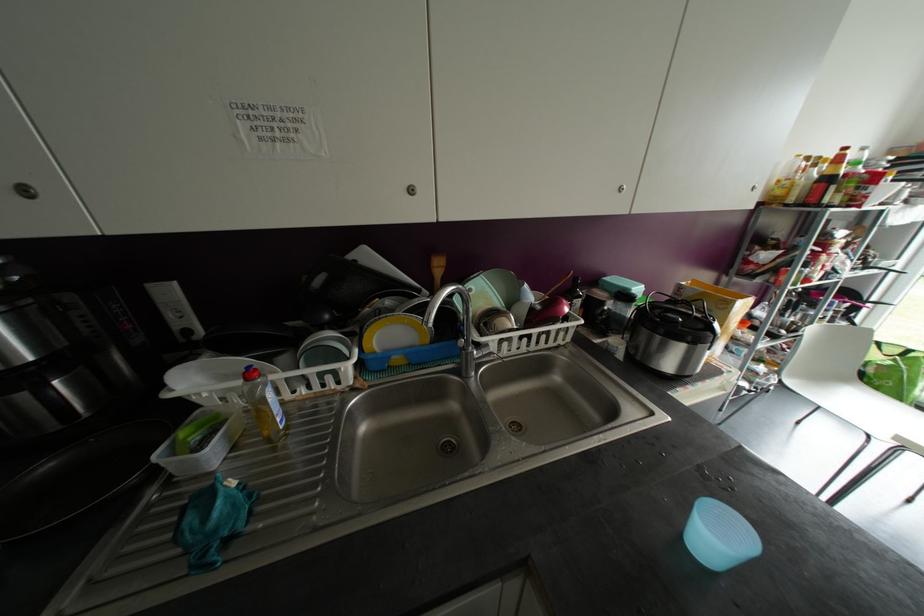
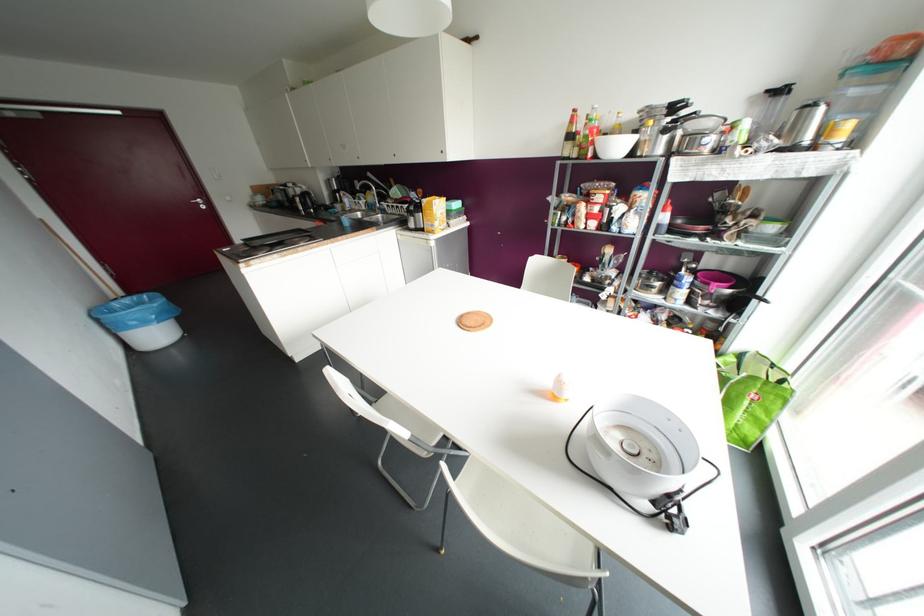
Find the pixel in the second image that matches pixel 879 342 in the first image.

(772, 365)